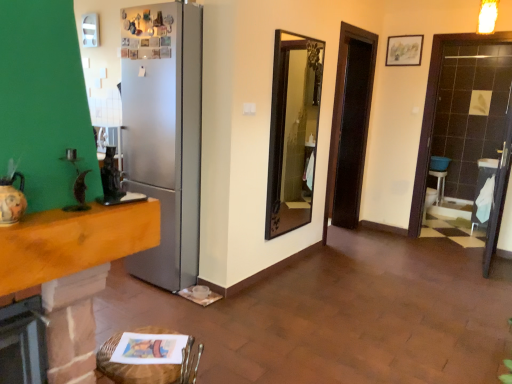
Where is `black glass screen door at right`? The image size is (512, 384). black glass screen door at right is located at coordinates (446, 106).

The image size is (512, 384). What do you see at coordinates (446, 106) in the screenshot?
I see `black glass screen door at right` at bounding box center [446, 106].

In order to face black glass screen door at right, should I rotate leftwards or rightwards?

You should rotate right by 31.765 degrees.

At what (x,y) coordinates should I click in order to perform the action: click on black glass screen door at right. Please return your answer as a coordinate pair (x, y). Looking at the image, I should click on (446, 106).